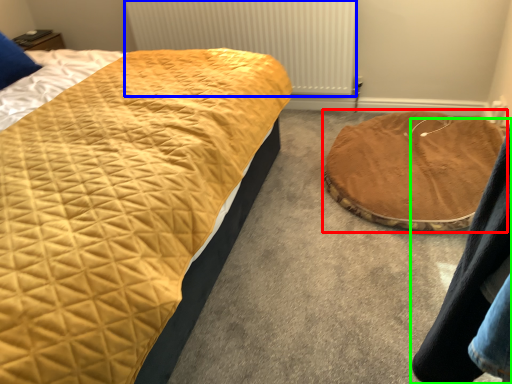
Question: Based on their relative distances, which object is nearer to cat bed (highlighted by a red box)? Choose from radiator (highlighted by a blue box) and couple (highlighted by a green box).

Choices:
 (A) radiator
 (B) couple

Answer: (A)